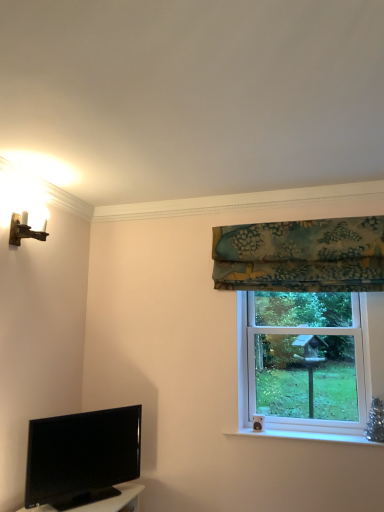
Question: Is wooden wall sconce at upper left not close to clear glass window at right?

Choices:
 (A) yes
 (B) no

Answer: (A)

Question: Considering the relative sizes of wooden wall sconce at upper left and clear glass window at right in the image provided, is wooden wall sconce at upper left smaller than clear glass window at right?

Choices:
 (A) yes
 (B) no

Answer: (A)

Question: Is clear glass window at right at the back of wooden wall sconce at upper left?

Choices:
 (A) no
 (B) yes

Answer: (A)

Question: Is wooden wall sconce at upper left taller than clear glass window at right?

Choices:
 (A) yes
 (B) no

Answer: (B)

Question: Is wooden wall sconce at upper left behind clear glass window at right?

Choices:
 (A) no
 (B) yes

Answer: (A)

Question: Is wooden wall sconce at upper left bigger or smaller than clear glass window at right?

Choices:
 (A) big
 (B) small

Answer: (B)

Question: From the image's perspective, is wooden wall sconce at upper left positioned above or below clear glass window at right?

Choices:
 (A) above
 (B) below

Answer: (A)

Question: Considering their positions, is wooden wall sconce at upper left located in front of or behind clear glass window at right?

Choices:
 (A) behind
 (B) front

Answer: (B)

Question: Is wooden wall sconce at upper left to the left or to the right of clear glass window at right in the image?

Choices:
 (A) right
 (B) left

Answer: (B)

Question: Considering their positions, is black glossy tv at lower left located in front of or behind teal floral fabric at upper right?

Choices:
 (A) front
 (B) behind

Answer: (A)

Question: Would you say black glossy tv at lower left is to the left or to the right of teal floral fabric at upper right in the picture?

Choices:
 (A) right
 (B) left

Answer: (B)

Question: From the image's perspective, relative to teal floral fabric at upper right, is black glossy tv at lower left above or below?

Choices:
 (A) below
 (B) above

Answer: (A)

Question: Does point (52, 477) appear closer or farther from the camera than point (269, 258)?

Choices:
 (A) farther
 (B) closer

Answer: (B)

Question: Is teal floral fabric at upper right bigger or smaller than black glossy tv at lower left?

Choices:
 (A) big
 (B) small

Answer: (A)

Question: From a real-world perspective, is teal floral fabric at upper right positioned above or below black glossy tv at lower left?

Choices:
 (A) below
 (B) above

Answer: (B)